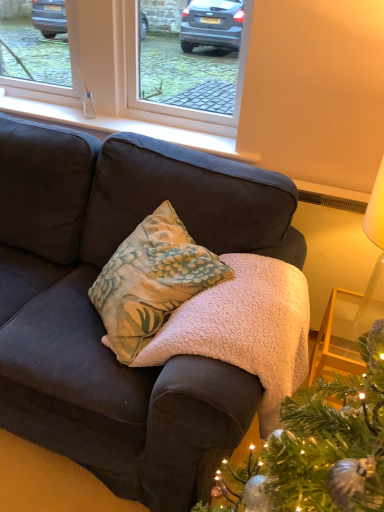
Question: Is white smooth window sill at upper center to the left or to the right of white fleece blanket at center in the image?

Choices:
 (A) left
 (B) right

Answer: (A)

Question: From the image's perspective, relative to white fleece blanket at center, is white smooth window sill at upper center above or below?

Choices:
 (A) above
 (B) below

Answer: (A)

Question: Estimate the real-world distances between objects in this image. Which object is closer to the white fleece blanket at center?

Choices:
 (A) white plastic window at upper center
 (B) white smooth window sill at upper center
 (C) white paper lampshade at upper right
 (D) floral-patterned fabric pillow at center

Answer: (D)

Question: Which of these objects is positioned farthest from the white plastic window at upper center?

Choices:
 (A) white smooth window sill at upper center
 (B) floral-patterned fabric pillow at center
 (C) white fleece blanket at center
 (D) white paper lampshade at upper right

Answer: (D)